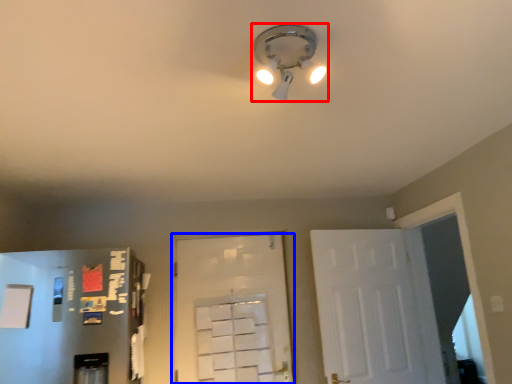
Question: Which object appears farthest to the camera in this image, lamp (highlighted by a red box) or door (highlighted by a blue box)?

Choices:
 (A) lamp
 (B) door

Answer: (B)